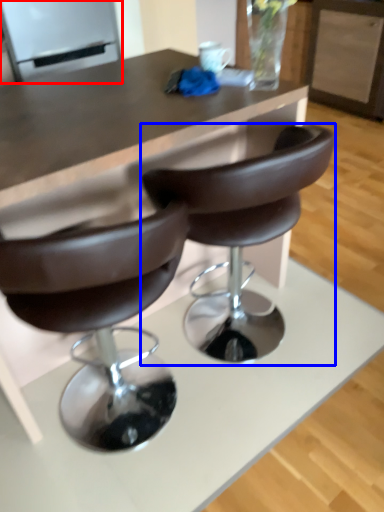
Question: Which object is closer to the camera taking this photo, appliance (highlighted by a red box) or chair (highlighted by a blue box)?

Choices:
 (A) appliance
 (B) chair

Answer: (B)